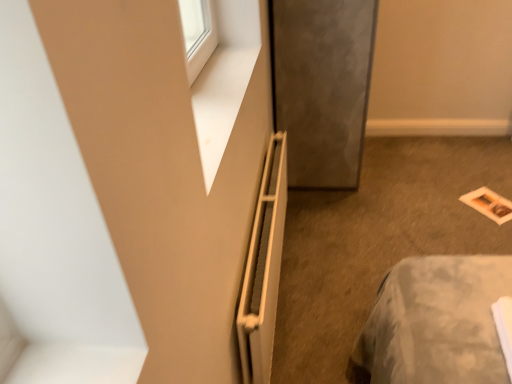
Locate an element on the screen. Image resolution: width=512 pixels, height=384 pixels. vacant space in front of matte paper magazine at lower right is located at coordinates pyautogui.click(x=487, y=224).